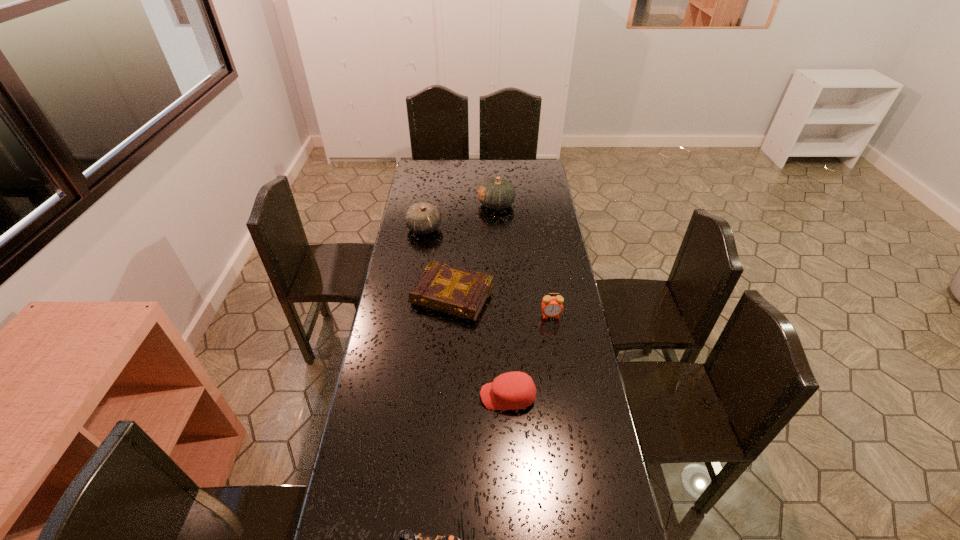
This screenshot has width=960, height=540. In order to click on the farthest object in this screenshot , I will do `click(496, 193)`.

I want to click on the right gourd, so click(x=496, y=193).

Where is `the shorter gourd`? This screenshot has height=540, width=960. the shorter gourd is located at coordinates (422, 218).

Image resolution: width=960 pixels, height=540 pixels. I want to click on the left gourd, so pyautogui.click(x=422, y=218).

Where is `alarm clock`? The height and width of the screenshot is (540, 960). alarm clock is located at coordinates (551, 306).

At what (x,y) coordinates should I click in order to perform the action: click on the third shortest object. Please return your answer as a coordinate pair (x, y). Looking at the image, I should click on (516, 390).

The image size is (960, 540). Identify the location of cap. (516, 390).

Locate an element on the screen. Image resolution: width=960 pixels, height=540 pixels. the fifth tallest object is located at coordinates (456, 291).

Where is `free location located on the back of the farther gourd`? free location located on the back of the farther gourd is located at coordinates (495, 180).

Find the location of a particular element. This screenshot has width=960, height=540. vacant region located 0.050m on the back of the nearer gourd is located at coordinates (427, 212).